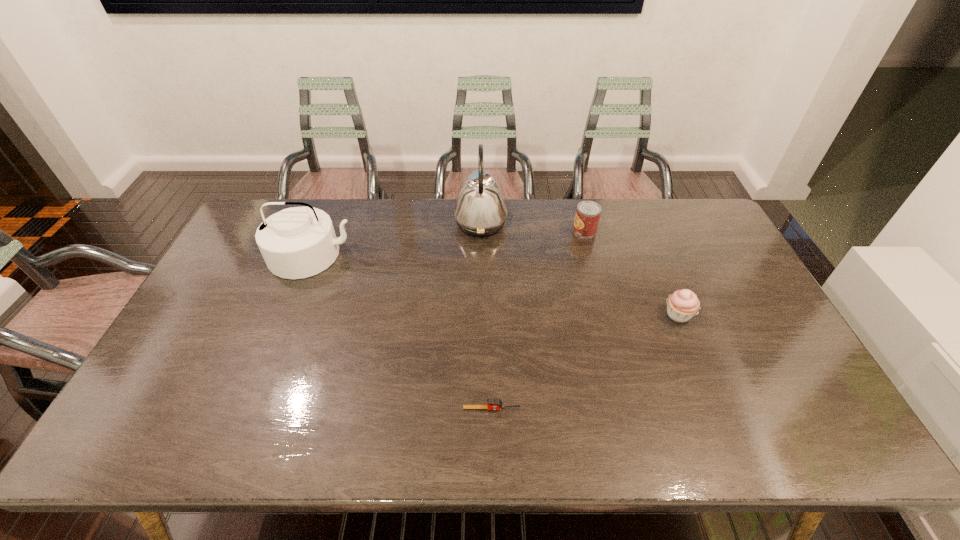
Where is `vacant space situated from the spout of the taller kettle`? The height and width of the screenshot is (540, 960). vacant space situated from the spout of the taller kettle is located at coordinates (412, 223).

The image size is (960, 540). I want to click on vacant area located 0.160m from the spout of the taller kettle, so click(x=409, y=223).

What are the coordinates of `free location located on the spout of the shorter kettle` in the screenshot? It's located at (281, 334).

Where is `vacant space situated 0.060m on the right of the cupcake`? This screenshot has height=540, width=960. vacant space situated 0.060m on the right of the cupcake is located at coordinates (715, 315).

The image size is (960, 540). I want to click on free space located 0.350m on the right of the can, so [696, 231].

Locate an element on the screen. vacant area situated on the right of the shortest object is located at coordinates (653, 408).

The image size is (960, 540). What are the coordinates of `can situated at the far edge` in the screenshot? It's located at (587, 216).

Locate an element on the screen. Image resolution: width=960 pixels, height=540 pixels. object that is at the left edge is located at coordinates (299, 242).

At what (x,y) coordinates should I click in order to perform the action: click on object situated at the far left corner. Please return your answer as a coordinate pair (x, y). This screenshot has width=960, height=540. Looking at the image, I should click on (299, 242).

Where is `blank space at the far edge of the desktop`? blank space at the far edge of the desktop is located at coordinates (669, 227).